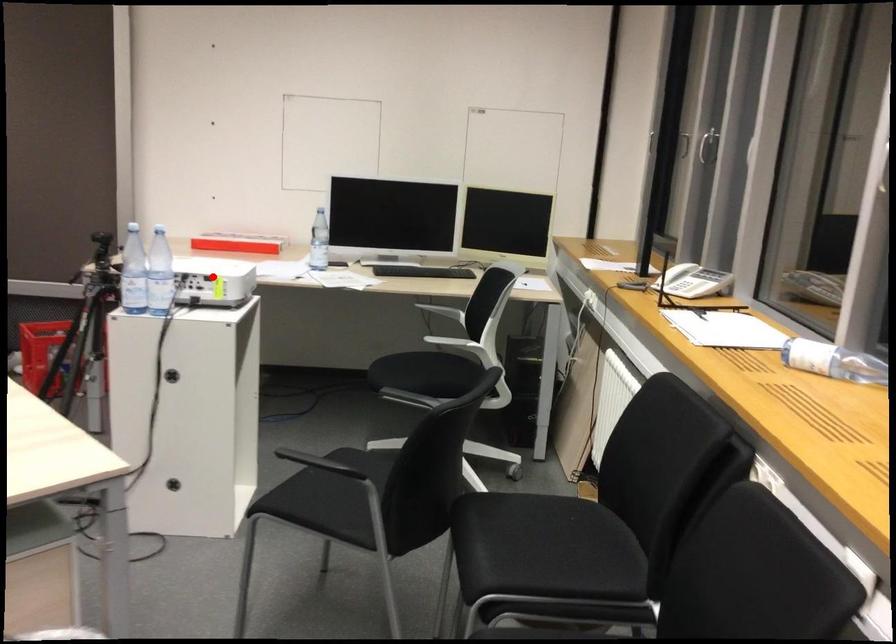
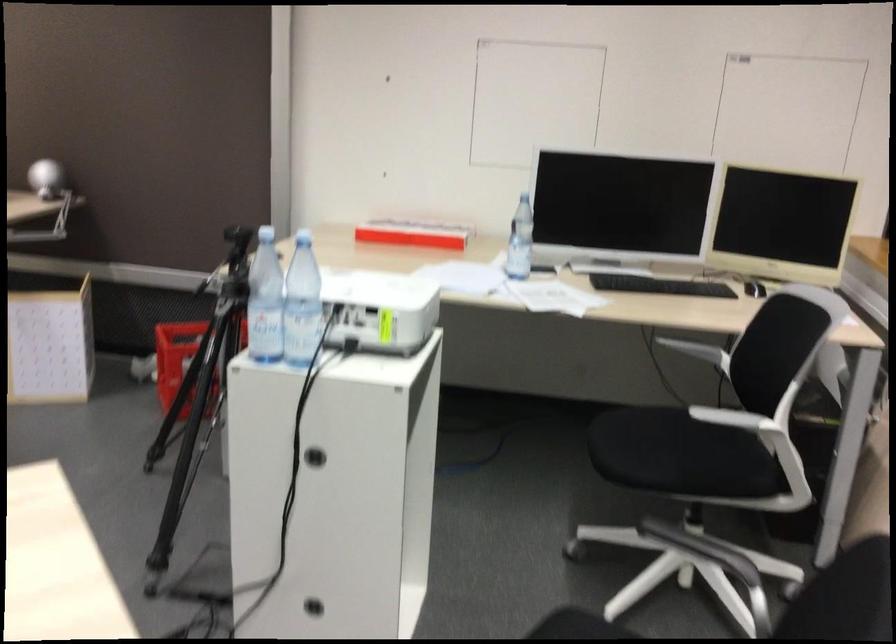
Question: I am providing you with two images of the same scene from different viewpoints. Image1 has a red point marked. In image2, the corresponding 3D location appears at what relative position? Reply with the corresponding letter.

Choices:
 (A) Closer
 (B) Farther

Answer: (A)